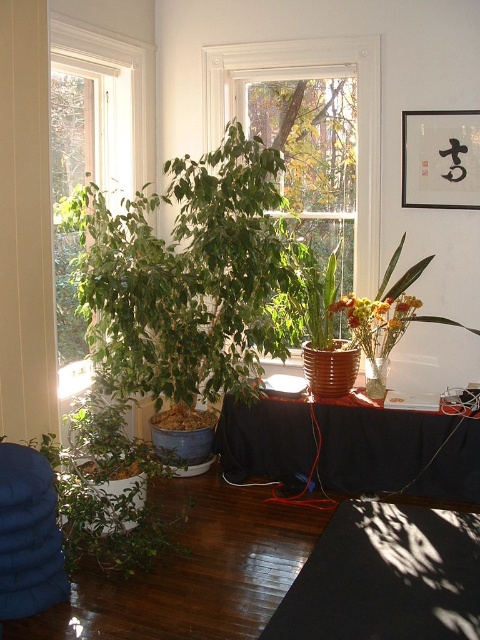
Question: Is black fabric table at center wider than white frame window at left?

Choices:
 (A) no
 (B) yes

Answer: (B)

Question: Which object appears farthest from the camera in this image?

Choices:
 (A) green matte plant at right
 (B) black fabric table at center
 (C) green matte plant at lower left

Answer: (A)

Question: From the image, what is the correct spatial relationship of green matte plant at left in relation to white wood window at center?

Choices:
 (A) below
 (B) above

Answer: (A)

Question: Does black rubber mat at lower center come behind green matte plant at right?

Choices:
 (A) no
 (B) yes

Answer: (A)

Question: Which object is positioned farthest from the green matte plant at lower left?

Choices:
 (A) green matte plant at right
 (B) black fabric table at center
 (C) black rubber mat at lower center

Answer: (A)

Question: Which is farther from the black fabric table at center?

Choices:
 (A) green matte plant at right
 (B) green matte plant at lower left
 (C) green matte plant at left
 (D) black rubber mat at lower center

Answer: (B)